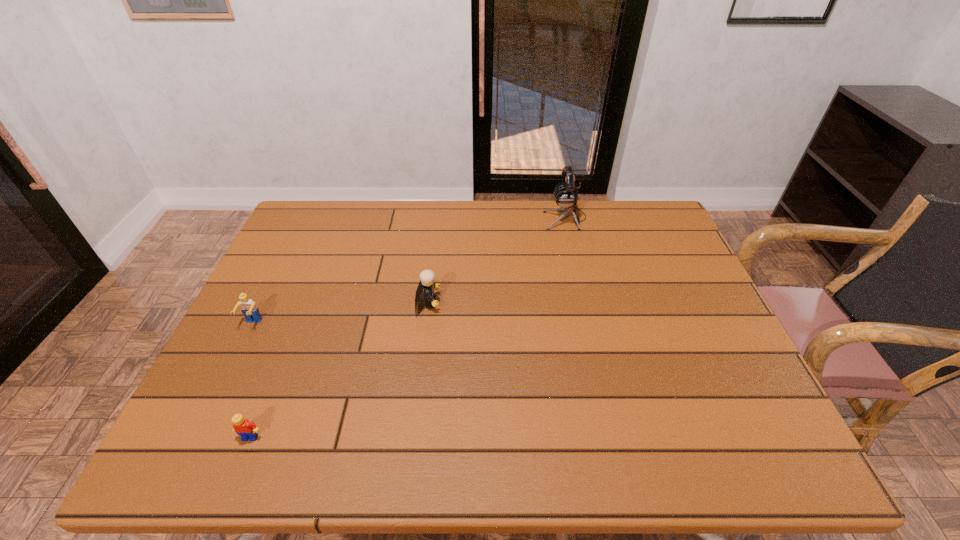
Locate an element on the screen. free region located 0.050m on the face of the third object from right to left is located at coordinates (239, 465).

This screenshot has width=960, height=540. What are the coordinates of `object at the far edge` in the screenshot? It's located at [566, 195].

Where is `object located at the near edge`? The image size is (960, 540). object located at the near edge is located at coordinates (246, 429).

Where is `object positioned at the near left corner`? Image resolution: width=960 pixels, height=540 pixels. object positioned at the near left corner is located at coordinates (246, 429).

In the image, there is a desktop. At what (x,y) coordinates should I click in order to perform the action: click on free space at the far edge. Please return your answer as a coordinate pair (x, y). This screenshot has height=540, width=960. Looking at the image, I should click on (386, 239).

Locate an element on the screen. This screenshot has width=960, height=540. blank space at the near edge of the desktop is located at coordinates (385, 464).

Locate an element on the screen. vacant space at the left edge of the desktop is located at coordinates (261, 370).

You are a GUI agent. You are given a task and a screenshot of the screen. Output one action in this format:
    pyautogui.click(x=<x>, y=<y>)
    Task: Click on the free space at the right edge of the desktop
    The image size is (960, 540).
    Given the screenshot: What is the action you would take?
    pyautogui.click(x=645, y=268)

Identify the location of vacant space at the near left corner of the desktop. Image resolution: width=960 pixels, height=540 pixels. (221, 447).

Find the location of `empty space that is in between the leftmost Lego and the third shortest object`. empty space that is in between the leftmost Lego and the third shortest object is located at coordinates (340, 313).